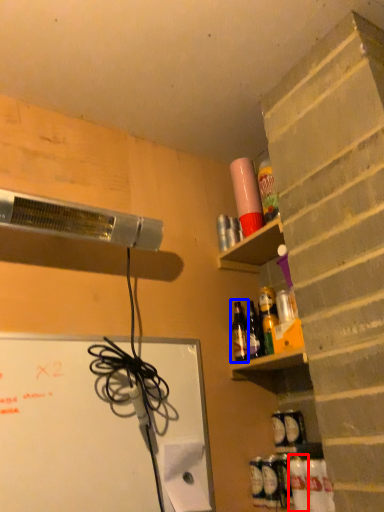
Question: Which of the following is the closest to the observer, bottle (highlighted by a red box) or bottle (highlighted by a blue box)?

Choices:
 (A) bottle
 (B) bottle

Answer: (A)